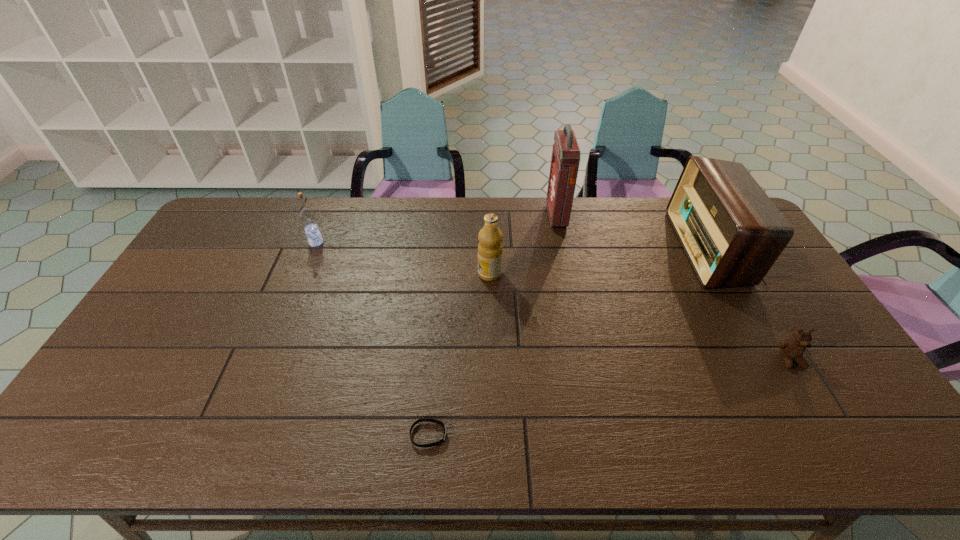
Image resolution: width=960 pixels, height=540 pixels. Identify the location of blank space located on the display of the nearest object. (540, 435).

In order to click on the first-aid kit that is positioned at the far edge in this screenshot , I will do `click(565, 160)`.

Find the location of a particular element. radio receiver located at the far edge is located at coordinates (732, 233).

Identify the location of vodka located in the far edge section of the desktop. This screenshot has width=960, height=540. (307, 216).

In order to click on object that is at the near edge in this screenshot , I will do `click(441, 423)`.

The width and height of the screenshot is (960, 540). Find the location of `radio receiver positioned at the right edge`. radio receiver positioned at the right edge is located at coordinates (732, 233).

The width and height of the screenshot is (960, 540). I want to click on teddy bear located at the right edge, so click(x=792, y=349).

What are the coordinates of `object at the far right corner` in the screenshot? It's located at tap(732, 233).

This screenshot has width=960, height=540. In the image, there is a desktop. In order to click on vacant area at the far edge in this screenshot , I will do `click(503, 206)`.

In the image, there is a desktop. What are the coordinates of `vacant space at the near edge` in the screenshot? It's located at (760, 444).